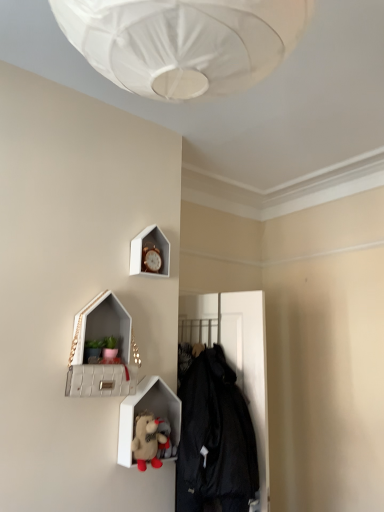
Question: Can you confirm if black matte coat at center is shorter than gold metallic clock at upper center?

Choices:
 (A) no
 (B) yes

Answer: (A)

Question: Is black matte coat at center to the right of gold metallic clock at upper center from the viewer's perspective?

Choices:
 (A) no
 (B) yes

Answer: (B)

Question: Does black matte coat at center lie in front of gold metallic clock at upper center?

Choices:
 (A) yes
 (B) no

Answer: (A)

Question: Is black matte coat at center wider than gold metallic clock at upper center?

Choices:
 (A) yes
 (B) no

Answer: (A)

Question: Considering the relative sizes of black matte coat at center and gold metallic clock at upper center in the image provided, is black matte coat at center taller than gold metallic clock at upper center?

Choices:
 (A) yes
 (B) no

Answer: (A)

Question: From a real-world perspective, does black matte coat at center sit lower than gold metallic clock at upper center?

Choices:
 (A) no
 (B) yes

Answer: (B)

Question: Is black matte coat at center thinner than fluffy plush toy at lower center?

Choices:
 (A) no
 (B) yes

Answer: (A)

Question: From the image's perspective, is black matte coat at center beneath fluffy plush toy at lower center?

Choices:
 (A) yes
 (B) no

Answer: (A)

Question: Is black matte coat at center looking in the opposite direction of fluffy plush toy at lower center?

Choices:
 (A) yes
 (B) no

Answer: (B)

Question: Is black matte coat at center positioned before fluffy plush toy at lower center?

Choices:
 (A) yes
 (B) no

Answer: (A)

Question: Is black matte coat at center bigger than fluffy plush toy at lower center?

Choices:
 (A) no
 (B) yes

Answer: (B)

Question: Does black matte coat at center turn towards fluffy plush toy at lower center?

Choices:
 (A) no
 (B) yes

Answer: (B)

Question: Is gold metallic clock at upper center at the right side of fluffy plush toy at lower center?

Choices:
 (A) no
 (B) yes

Answer: (A)